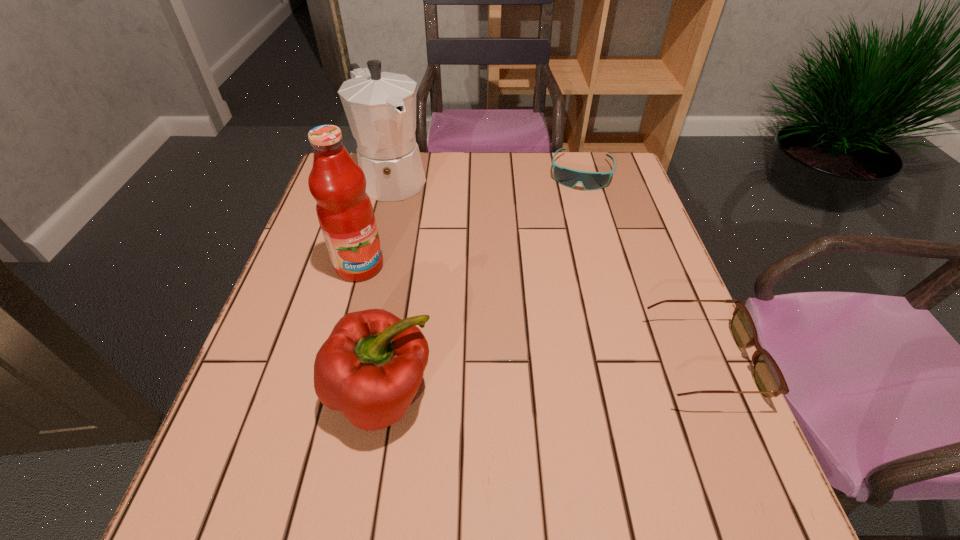
In the image, there is a desktop. Where is `blank space at the far right corner`? The image size is (960, 540). blank space at the far right corner is located at coordinates (579, 153).

In the image, there is a desktop. At what (x,y) coordinates should I click in order to perform the action: click on vacant space at the near right corner. Please return your answer as a coordinate pair (x, y). The height and width of the screenshot is (540, 960). Looking at the image, I should click on pos(701,415).

Find the location of `free space between the third farthest object and the shortest object`. free space between the third farthest object and the shortest object is located at coordinates (470, 219).

Locate an element on the screen. vacant region between the spectacles and the third nearest object is located at coordinates (530, 314).

Find the location of a particular element. This screenshot has height=540, width=960. vacant space that's between the coffeepot and the spectacles is located at coordinates (546, 270).

This screenshot has width=960, height=540. I want to click on vacant space that is in between the spectacles and the shortest object, so click(x=640, y=267).

Where is `vacant space in between the third farthest object and the shortest object`? The height and width of the screenshot is (540, 960). vacant space in between the third farthest object and the shortest object is located at coordinates (470, 219).

Image resolution: width=960 pixels, height=540 pixels. What are the coordinates of `unoccupied position between the shortest object and the coffeepot` in the screenshot? It's located at (487, 175).

The height and width of the screenshot is (540, 960). I want to click on unoccupied area between the spectacles and the shortest object, so click(640, 267).

Identify the location of vacant space that's between the third tallest object and the coffeepot. This screenshot has width=960, height=540. (387, 286).